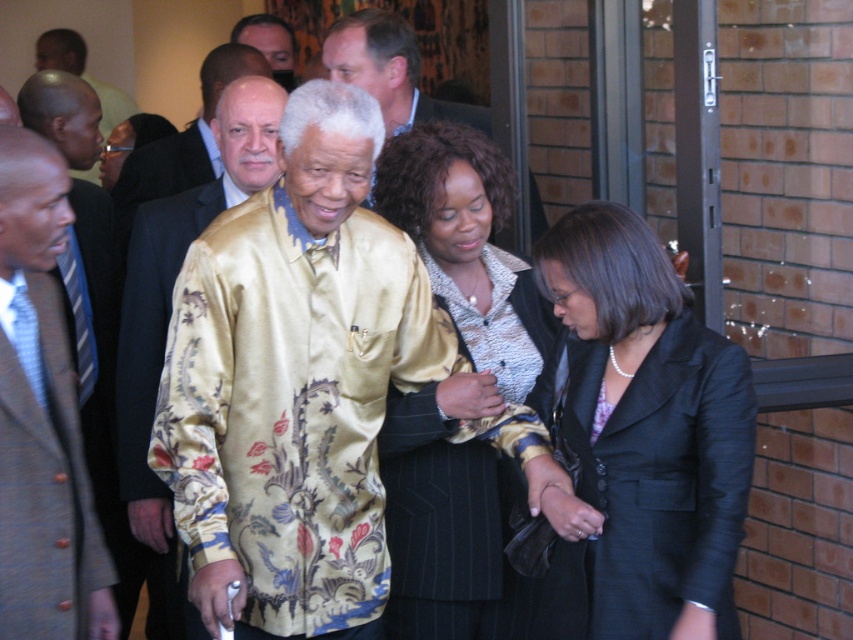
Question: Is the position of black pinstripe suit at center less distant than that of light brown suit at upper left?

Choices:
 (A) no
 (B) yes

Answer: (B)

Question: Which object is positioned farthest from the black satin blazer at lower right?

Choices:
 (A) smooth black suit at center
 (B) dark gray wool business suit at center
 (C) brown wool suit at left

Answer: (A)

Question: Considering the relative positions of gold satin robe at center and dark gray wool business suit at center in the image provided, where is gold satin robe at center located with respect to dark gray wool business suit at center?

Choices:
 (A) below
 (B) above

Answer: (A)

Question: Based on their relative distances, which object is farther from the brown wool suit at left?

Choices:
 (A) silky yellow shirt at center
 (B) light brown suit at upper left
 (C) gold silk robe at center

Answer: (B)

Question: Is light brown suit at upper left closer to the viewer compared to dark gray wool business suit at center?

Choices:
 (A) yes
 (B) no

Answer: (B)

Question: Which point is farther to the camera?

Choices:
 (A) (518, 352)
 (B) (285, 68)

Answer: (B)